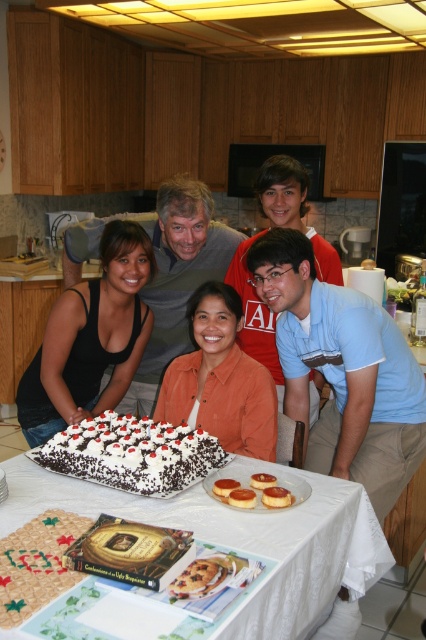
Is blue cotton shirt at center positioned before white frosted cake at center?

No, blue cotton shirt at center is further to the viewer.

Does blue cotton shirt at center lie behind white frosted cake at center?

Yes, it is.

Locate an element on the screen. blue cotton shirt at center is located at coordinates (344, 371).

Is blue cotton shirt at center to the left of black fabric at center from the viewer's perspective?

No, blue cotton shirt at center is not to the left of black fabric at center.

Can you confirm if blue cotton shirt at center is bigger than black fabric at center?

Yes.

Locate an element on the screen. This screenshot has width=426, height=640. blue cotton shirt at center is located at coordinates (344, 371).

Where is `blue cotton shirt at center`? Image resolution: width=426 pixels, height=640 pixels. blue cotton shirt at center is located at coordinates (344, 371).

Is black fabric at center bigger than red shirt at center?

No, black fabric at center is not bigger than red shirt at center.

Is black fabric at center to the right of red shirt at center from the viewer's perspective?

No, black fabric at center is not to the right of red shirt at center.

Who is more distant from viewer, (108,296) or (255,339)?

The point (255,339) is behind.

Identify the location of black fabric at center. The height and width of the screenshot is (640, 426). (89, 339).